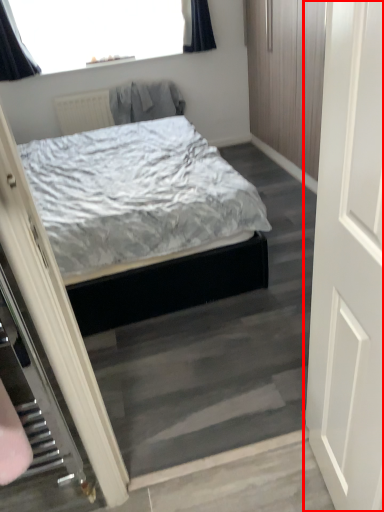
Question: Considering the relative positions of door (annotated by the red box) and robe in the image provided, where is door (annotated by the red box) located with respect to the staircase?

Choices:
 (A) left
 (B) right

Answer: (B)